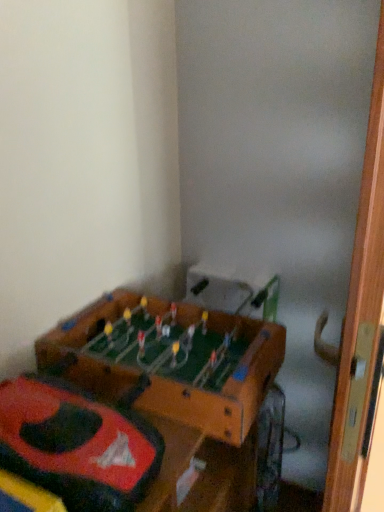
Identify the location of wooden door at right. The height and width of the screenshot is (512, 384). (361, 323).

The image size is (384, 512). Describe the element at coordinates (169, 360) in the screenshot. I see `wooden foosball table at lower left` at that location.

Where is `rubberized red car at lower left`? The width and height of the screenshot is (384, 512). rubberized red car at lower left is located at coordinates (76, 445).

This screenshot has height=512, width=384. I want to click on wooden door at right, so [361, 323].

Is wooden foosball table at lower left inside or outside of rubberized red car at lower left?

wooden foosball table at lower left is not enclosed by rubberized red car at lower left.

From the image's perspective, which is above, wooden foosball table at lower left or rubberized red car at lower left?

wooden foosball table at lower left is shown above in the image.

Is wooden foosball table at lower left oriented away from rubberized red car at lower left?

No, wooden foosball table at lower left is not facing the opposite direction of rubberized red car at lower left.

Considering the relative positions of wooden foosball table at lower left and rubberized red car at lower left in the image provided, is wooden foosball table at lower left to the left of rubberized red car at lower left from the viewer's perspective?

No.

Is wooden door at right wider or thinner than wooden foosball table at lower left?

Considering their sizes, wooden door at right looks slimmer than wooden foosball table at lower left.

From a real-world perspective, is wooden door at right above or below wooden foosball table at lower left?

Clearly, from a real-world perspective, wooden door at right is below wooden foosball table at lower left.

What are the coordinates of `door below the wooden foosball table at lower left (from a real-world perspective)` in the screenshot? It's located at (361, 323).

Based on their positions, is wooden door at right located to the left or right of wooden foosball table at lower left?

In the image, wooden door at right appears on the right side of wooden foosball table at lower left.

Does wooden door at right have a smaller size compared to rubberized red car at lower left?

Incorrect, wooden door at right is not smaller in size than rubberized red car at lower left.

Is wooden door at right positioned with its back to rubberized red car at lower left?

wooden door at right does not have its back to rubberized red car at lower left.

Considering the sizes of wooden door at right and rubberized red car at lower left in the image, is wooden door at right taller or shorter than rubberized red car at lower left?

Clearly, wooden door at right is taller compared to rubberized red car at lower left.

The width and height of the screenshot is (384, 512). Identify the location of door that appears in front of the wooden foosball table at lower left. (361, 323).

Is wooden foosball table at lower left aimed at wooden door at right?

Yes, wooden foosball table at lower left is oriented towards wooden door at right.

Is wooden foosball table at lower left taller than wooden door at right?

Incorrect, the height of wooden foosball table at lower left is not larger of that of wooden door at right.

Between wooden foosball table at lower left and wooden door at right, which one has smaller size?

wooden foosball table at lower left is smaller.

Which of these two, rubberized red car at lower left or wooden door at right, stands taller?

wooden door at right is taller.

From the image's perspective, would you say rubberized red car at lower left is positioned over wooden door at right?

Yes, from the image's perspective, rubberized red car at lower left is above wooden door at right.

Can you tell me how much rubberized red car at lower left and wooden door at right differ in facing direction?

1.71 degrees separate the facing orientations of rubberized red car at lower left and wooden door at right.

Is rubberized red car at lower left not near wooden door at right?

No.

Who is bigger, rubberized red car at lower left or wooden foosball table at lower left?

With larger size is wooden foosball table at lower left.

Between rubberized red car at lower left and wooden foosball table at lower left, which one has more height?

wooden foosball table at lower left is taller.

In the scene shown: Based on their positions, is rubberized red car at lower left located to the left or right of wooden foosball table at lower left?

rubberized red car at lower left is to the left of wooden foosball table at lower left.

How distant is rubberized red car at lower left from wooden foosball table at lower left?

They are 8.61 inches apart.

At what (x,y) coordinates should I click in order to perform the action: click on kit lying below the wooden foosball table at lower left (from the image's perspective). Please return your answer as a coordinate pair (x, y). Image resolution: width=384 pixels, height=512 pixels. Looking at the image, I should click on (76, 445).

You are a GUI agent. You are given a task and a screenshot of the screen. Output one action in this format:
    pyautogui.click(x=<x>, y=<y>)
    Task: Click on the door located on the right of wooden foosball table at lower left
    
    Given the screenshot: What is the action you would take?
    pyautogui.click(x=361, y=323)

Considering their positions, is rubberized red car at lower left positioned further to wooden foosball table at lower left than wooden door at right?

Among the two, wooden door at right is located further to wooden foosball table at lower left.

Considering their positions, is wooden door at right positioned closer to rubberized red car at lower left than wooden foosball table at lower left?

Among the two, wooden foosball table at lower left is located nearer to rubberized red car at lower left.

Looking at the image, which one is located further to wooden foosball table at lower left, wooden door at right or rubberized red car at lower left?

Based on the image, wooden door at right appears to be further to wooden foosball table at lower left.

Which object lies nearer to the anchor point rubberized red car at lower left, wooden foosball table at lower left or wooden door at right?

Among the two, wooden foosball table at lower left is located nearer to rubberized red car at lower left.

Looking at the image, which one is located further to wooden door at right, rubberized red car at lower left or wooden foosball table at lower left?

wooden foosball table at lower left lies further to wooden door at right than the other object.

When comparing their distances from wooden door at right, does wooden foosball table at lower left or rubberized red car at lower left seem further?

wooden foosball table at lower left.

At what (x,y) coordinates should I click in order to perform the action: click on table between rubberized red car at lower left and wooden door at right in the horizontal direction. Please return your answer as a coordinate pair (x, y). Looking at the image, I should click on (169, 360).